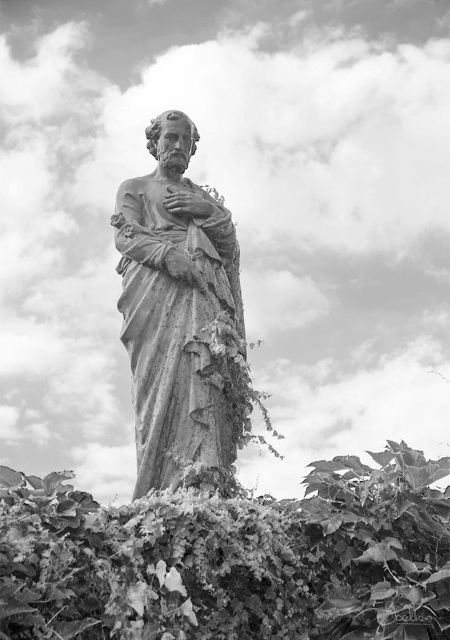
Find the location of `leathery green leaves at center`. leathery green leaves at center is located at coordinates (232, 557).

Is leathery green leaves at center shorter than stone statue at center?

Yes.

Is point (131, 540) closer to viewer compared to point (149, 304)?

That is True.

This screenshot has width=450, height=640. Identify the location of leathery green leaves at center. (232, 557).